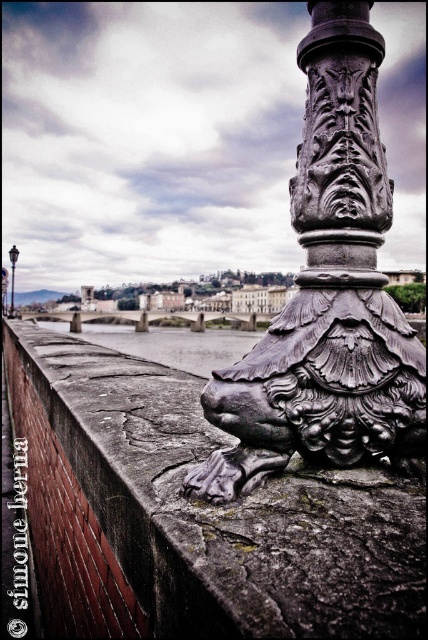
You are a tourist standing on the bridge and want to take a photo of both the polished metal lion at center and the polished metal lamp post at upper center. Which object should you focus on first if you want to include both in your frame without moving the camera?

The polished metal lion at center is shorter than the polished metal lamp post at upper center, so you should focus on the polished metal lamp post at upper center first to ensure both are in frame.

You are standing on the bridge and want to take a photo of the town in the background. There are two objects in your way. One is the polished metal lion at center and the other is the polished metal lamp post at upper center. Which object is closer to the right side of your view so you can frame the town better?

The polished metal lion at center is to the right of the polished metal lamp post at upper center, so it is closer to the right side of your view.